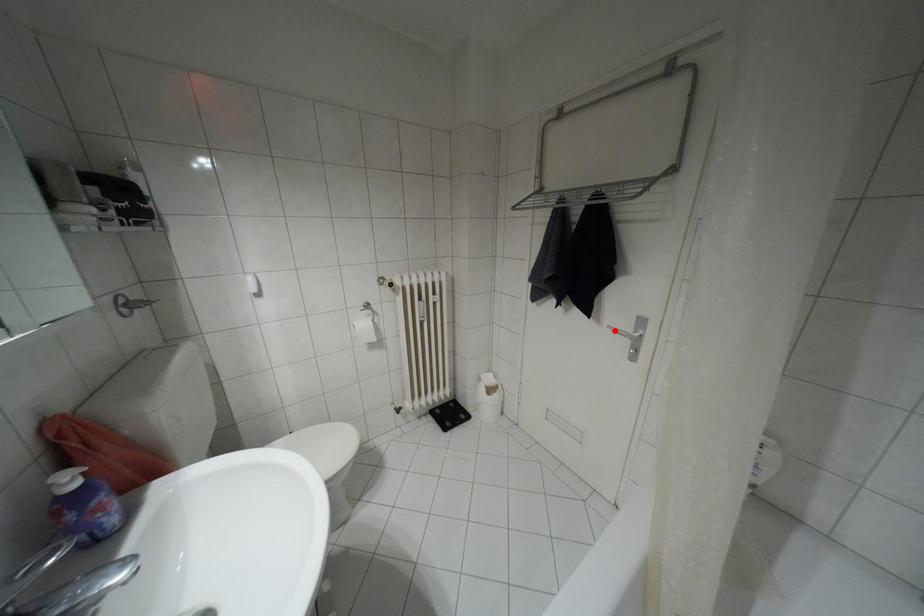
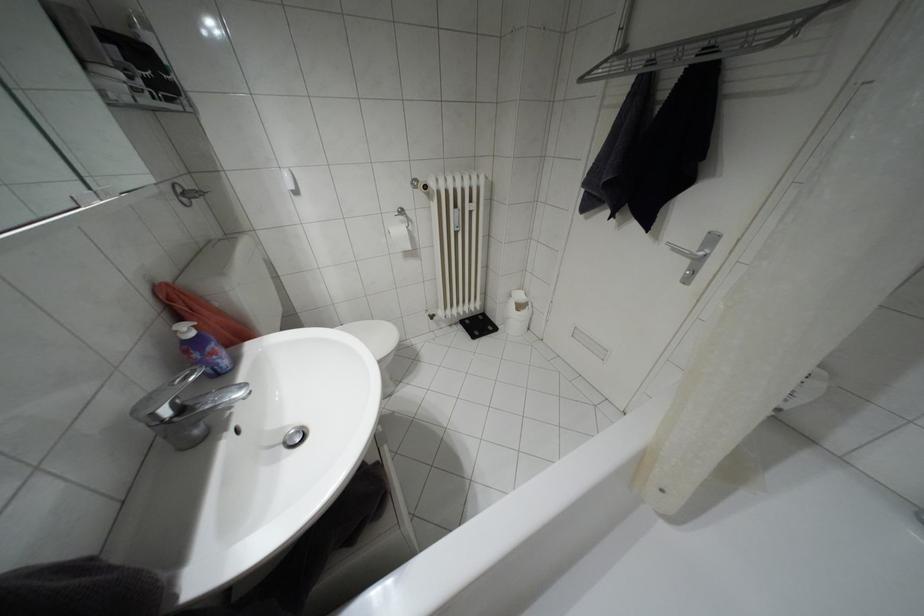
The point at the highlighted location is marked in the first image. Where is the corresponding point in the second image?

(675, 249)